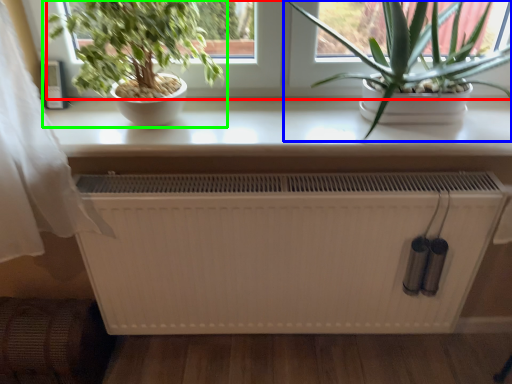
Question: Which object is the farthest from window screen (highlighted by a red box)? Choose among these: houseplant (highlighted by a blue box) or houseplant (highlighted by a green box).

Choices:
 (A) houseplant
 (B) houseplant

Answer: (B)